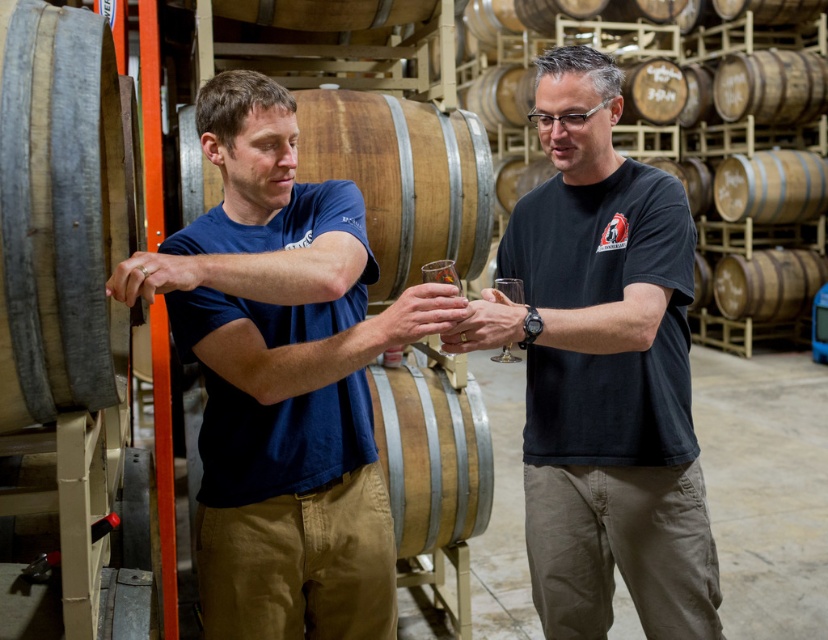
Question: Which of the following is the closest to the observer?

Choices:
 (A) (379, 209)
 (B) (384, 472)
 (C) (34, 422)
 (D) (579, 97)

Answer: (C)

Question: In this image, where is blue cotton shirt at center located relative to wooden barrel at center?

Choices:
 (A) right
 (B) left

Answer: (B)

Question: Can you confirm if smooth gray wood barrel at left is positioned below transparent glass at center?

Choices:
 (A) yes
 (B) no

Answer: (B)

Question: Which of the following is the farthest from the observer?

Choices:
 (A) wooden barrel at center
 (B) light brown wood barrel at center
 (C) blue cotton shirt at center

Answer: (B)

Question: Is blue cotton shirt at center smaller than black matte t-shirt at center?

Choices:
 (A) yes
 (B) no

Answer: (A)

Question: Which point is closer to the camera?

Choices:
 (A) black matte t-shirt at center
 (B) wooden barrel at center

Answer: (A)